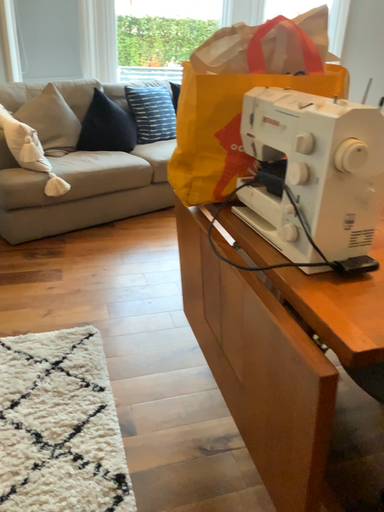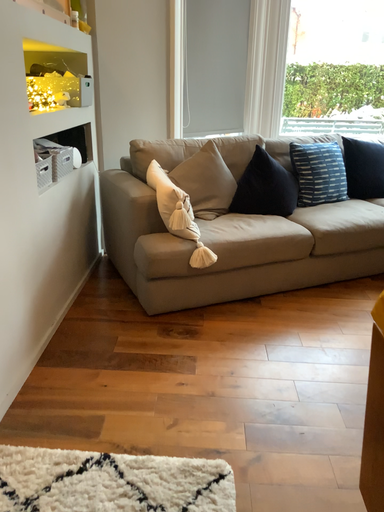
Question: Which way did the camera rotate in the video?

Choices:
 (A) rotated downward
 (B) rotated upward

Answer: (B)